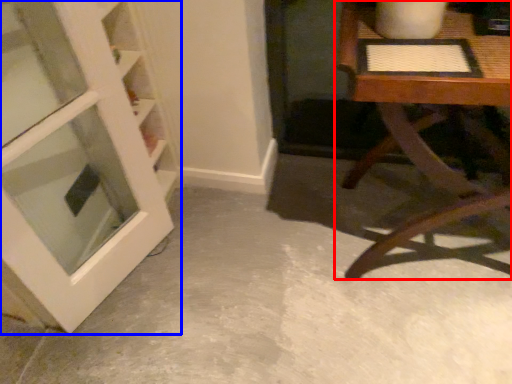
Question: Which point is closer to the camera, table (highlighted by a red box) or door (highlighted by a blue box)?

Choices:
 (A) table
 (B) door

Answer: (B)